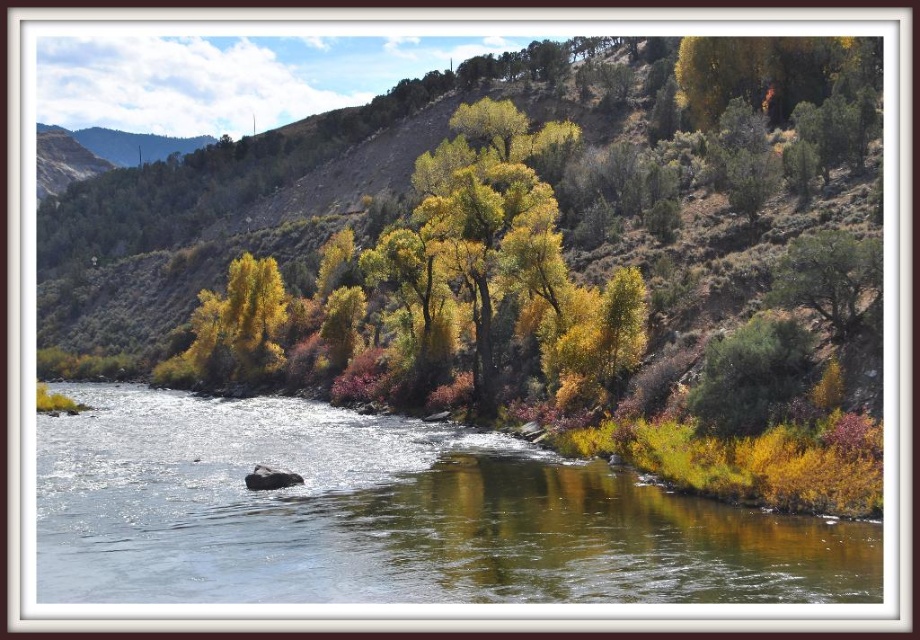
Is greenish reflective water at center further to the viewer compared to green leafy tree at center-right?

No, greenish reflective water at center is closer to the viewer.

Looking at this image, is greenish reflective water at center wider than green leafy tree at center-right?

Yes.

Which is in front, point (194, 397) or point (859, 273)?

Point (859, 273) is more forward.

Where is `greenish reflective water at center`? The image size is (920, 640). greenish reflective water at center is located at coordinates (391, 515).